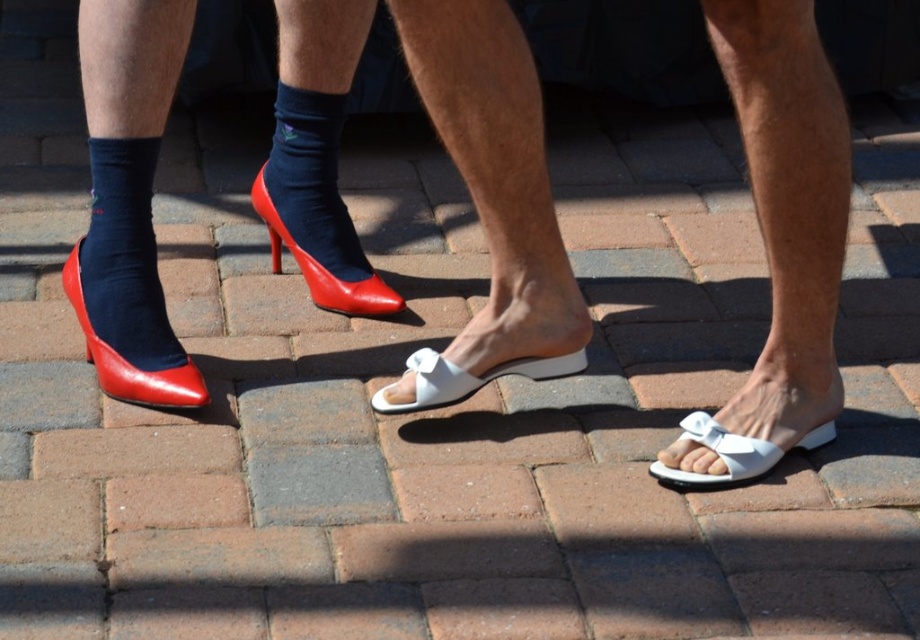
Where is `shiny red high-heeled shoe at center-left`? shiny red high-heeled shoe at center-left is located at coordinates (322, 268).

Which is below, shiny red high-heeled shoe at center-left or white matte sandal at lower right?

white matte sandal at lower right is lower down.

Locate an element on the screen. shiny red high-heeled shoe at center-left is located at coordinates (322, 268).

The width and height of the screenshot is (920, 640). What are the coordinates of `shiny red high-heeled shoe at center-left` in the screenshot? It's located at (322, 268).

Measure the distance between point (106, 225) and camera.

Point (106, 225) is 9.80 feet from camera.

You are a GUI agent. You are given a task and a screenshot of the screen. Output one action in this format:
    pyautogui.click(x=<x>, y=<y>)
    Task: Click on the black smooth sock at left
    
    Given the screenshot: What is the action you would take?
    pyautogui.click(x=125, y=257)

Does matte red high-heeled shoe at left have a greater height compared to white leather sandal at center?

Yes.

Can you confirm if matte red high-heeled shoe at left is positioned above white leather sandal at center?

Indeed, matte red high-heeled shoe at left is positioned over white leather sandal at center.

Which is behind, point (139, 378) or point (430, 364)?

Point (139, 378)

Locate an element on the screen. Image resolution: width=920 pixels, height=640 pixels. matte red high-heeled shoe at left is located at coordinates (129, 362).